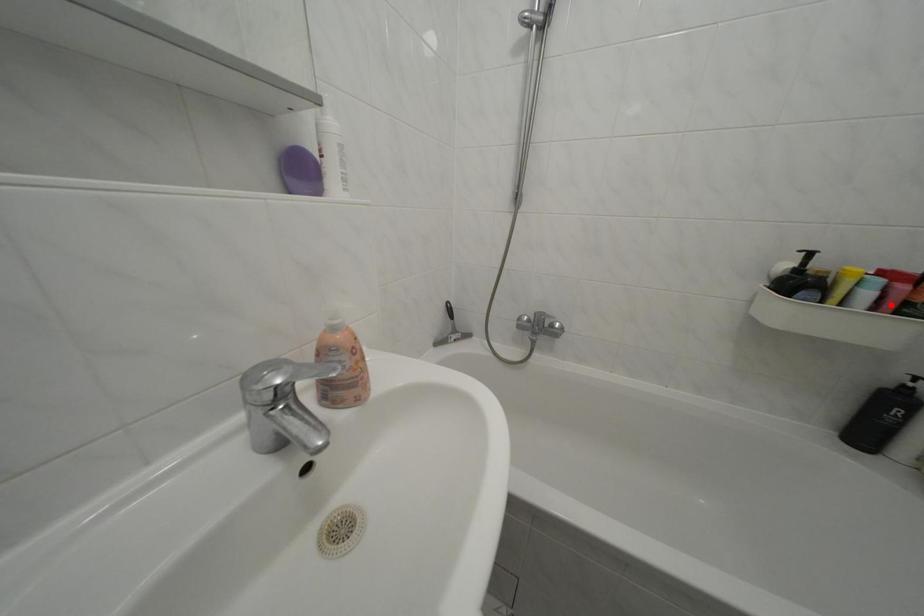
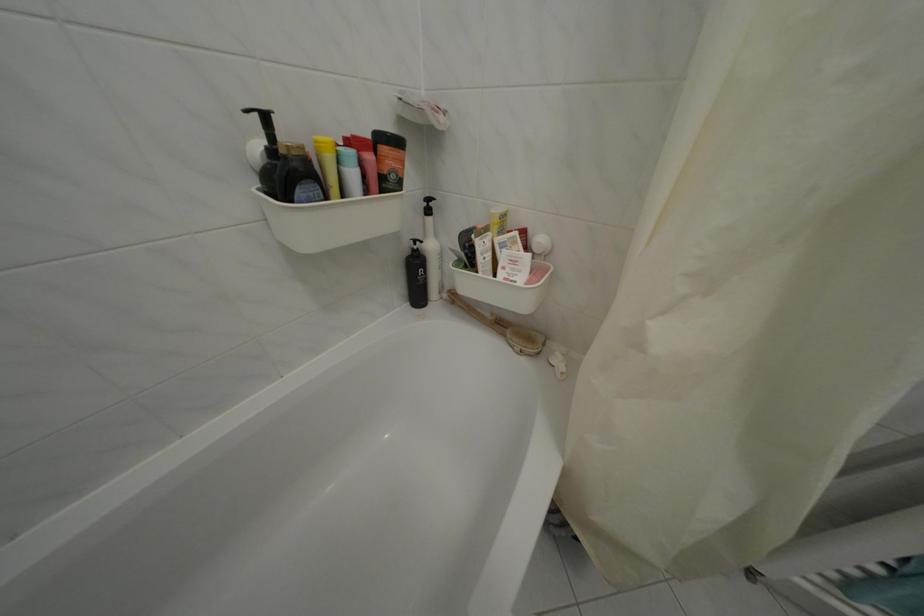
Where in the second image is the point corresponding to the highlighted location from the first image?

(372, 182)